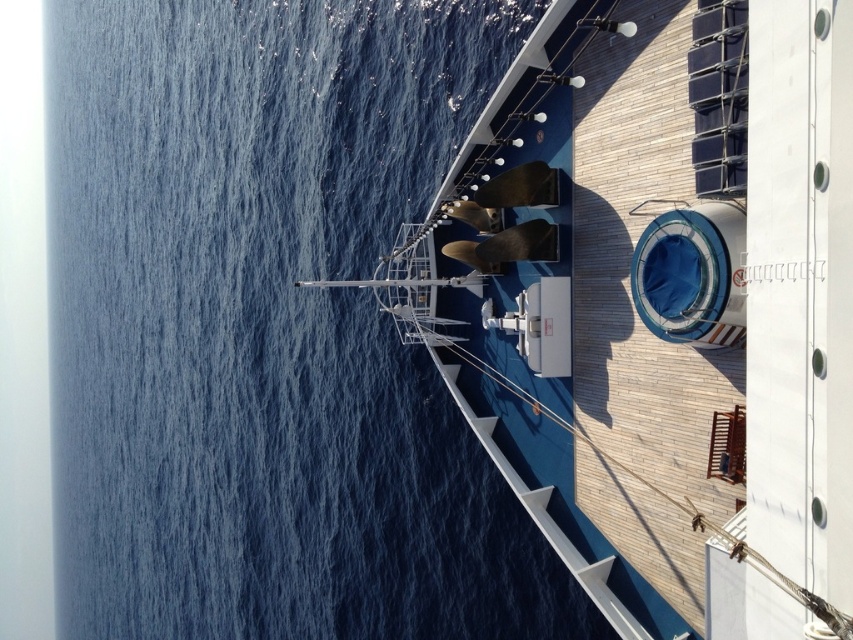
Who is more forward, (260, 51) or (624, 534)?

Point (624, 534) is in front.

Can you confirm if blue water at upper left is taller than white glossy boat at upper center?

Correct, blue water at upper left is much taller as white glossy boat at upper center.

Who is more distant from viewer, (276,611) or (521,289)?

The point (276,611) is more distant.

The height and width of the screenshot is (640, 853). Find the location of `blue water at upper left`. blue water at upper left is located at coordinates (268, 326).